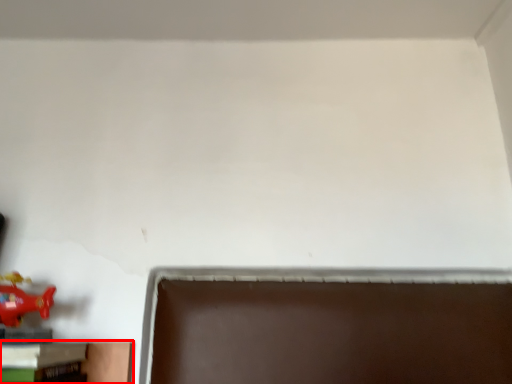
Question: From the image's perspective, what is the correct spatial relationship of furniture (annotated by the red box) in relation to toy?

Choices:
 (A) above
 (B) below

Answer: (B)